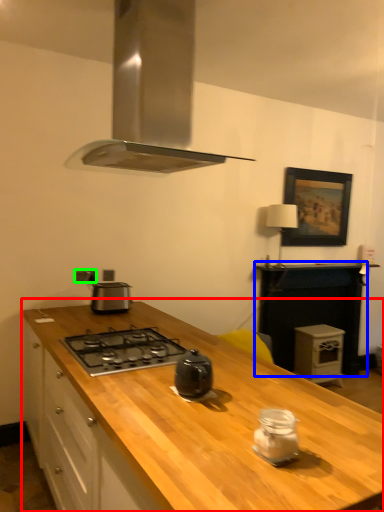
Question: Which object is positioned farthest from countertop (highlighted by a red box)? Select from counter top (highlighted by a blue box) and electric outlet (highlighted by a green box).

Choices:
 (A) counter top
 (B) electric outlet

Answer: (A)